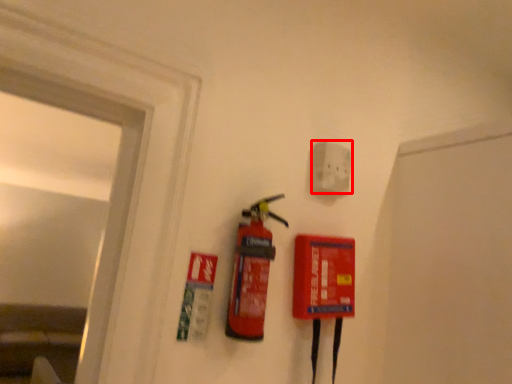
Question: From the image's perspective, considering the relative positions of electric outlet (annotated by the red box) and fire extinguisher in the image provided, where is electric outlet (annotated by the red box) located with respect to the staircase?

Choices:
 (A) below
 (B) above

Answer: (B)